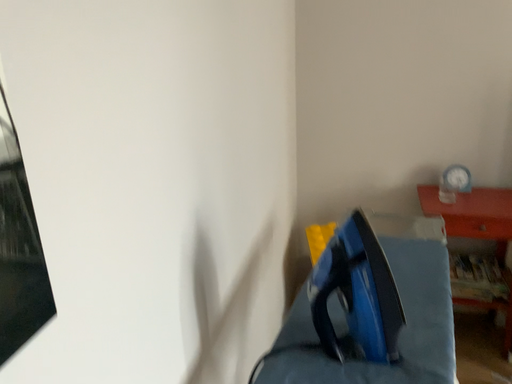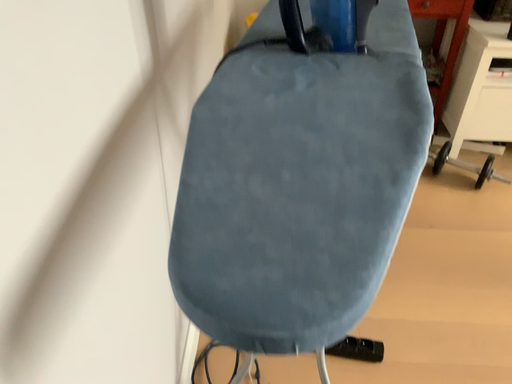
Question: Which way did the camera rotate in the video?

Choices:
 (A) rotated right
 (B) rotated left

Answer: (A)